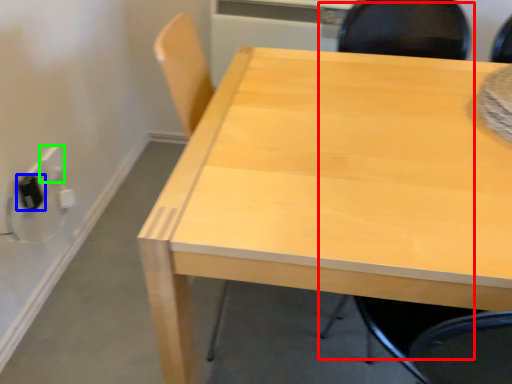
Question: Considering the real-world distances, which object is closest to chair (highlighted by a red box)? electric outlet (highlighted by a blue box) or electric outlet (highlighted by a green box).

Choices:
 (A) electric outlet
 (B) electric outlet

Answer: (B)